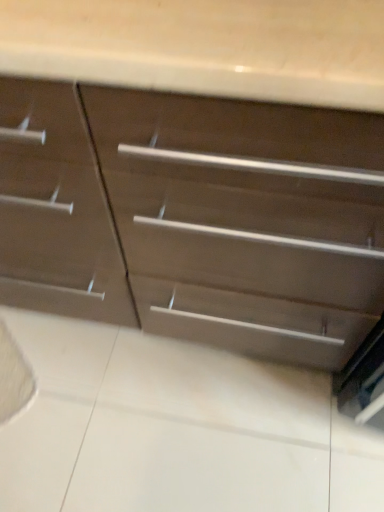
Question: Should I look upward or downward to see matte brown drawer at center?

Choices:
 (A) up
 (B) down

Answer: (A)